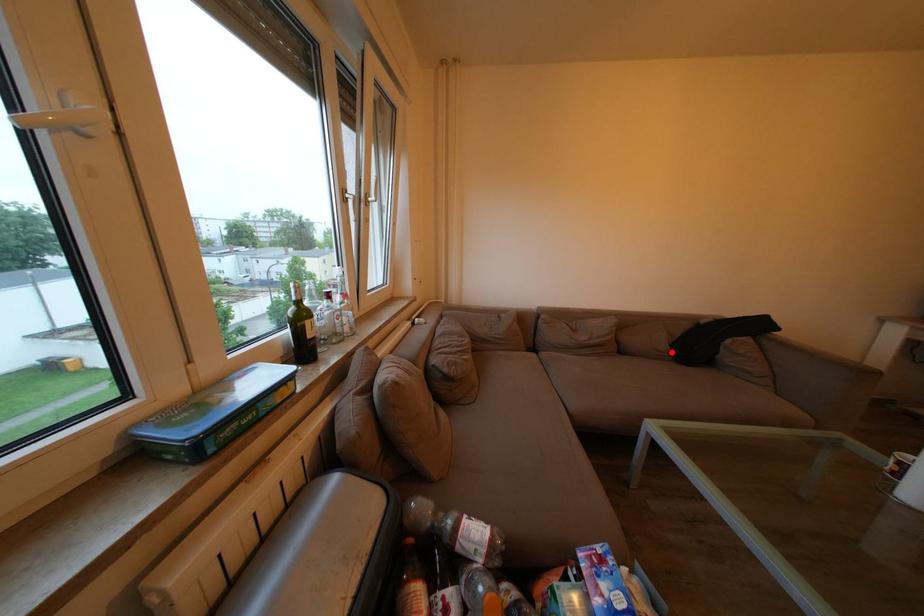
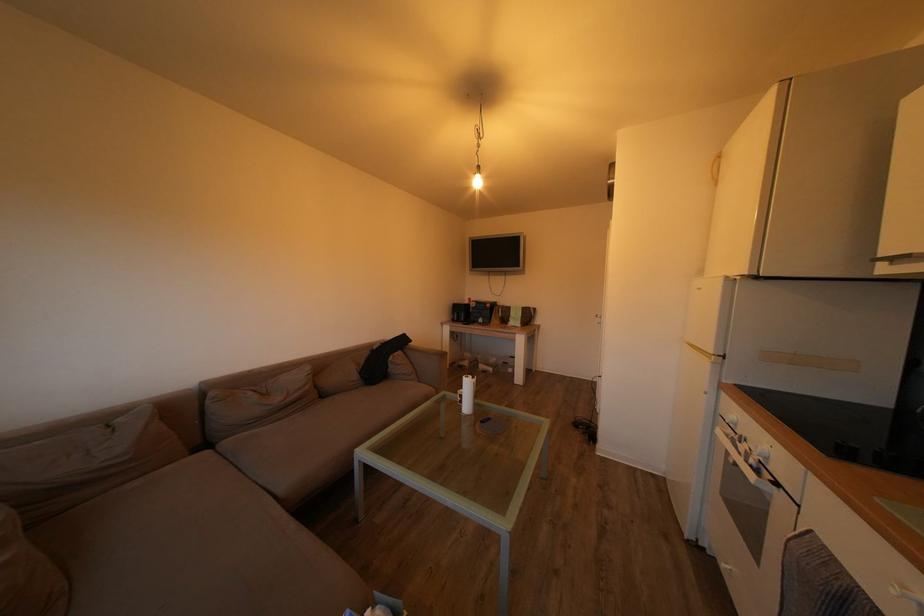
The point at the highlighted location is marked in the first image. Where is the corresponding point in the second image?

(362, 382)